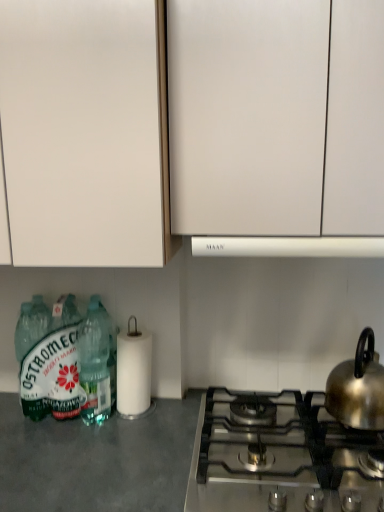
Where is `free location in front of shiny metallic kettle at right`? free location in front of shiny metallic kettle at right is located at coordinates (353, 446).